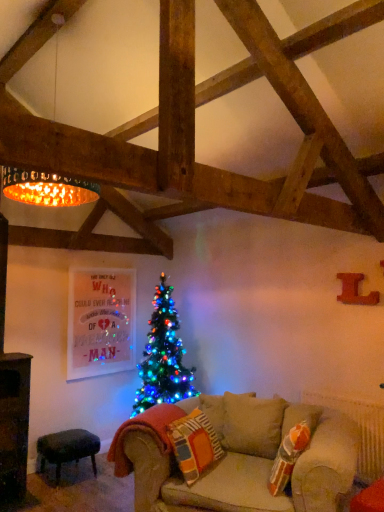
What is the approximate width of velvet dark green stool at lower left?

velvet dark green stool at lower left is 20.85 inches in width.

Describe the element at coordinates (47, 188) in the screenshot. I see `golden metallic lampshade at upper left` at that location.

Find the location of a particular element. Image resolution: width=384 pixels, height=512 pixels. velvet dark green stool at lower left is located at coordinates (67, 449).

Would you say velvet dark green stool at lower left is a long distance from knitted fabric pillow at lower center?

Indeed, velvet dark green stool at lower left is not near knitted fabric pillow at lower center.

The width and height of the screenshot is (384, 512). I want to click on stool that appears below the knitted fabric pillow at lower center (from the image's perspective), so click(x=67, y=449).

Is velvet dark green stool at lower left bigger than knitted fabric pillow at lower center?

Yes, velvet dark green stool at lower left is bigger than knitted fabric pillow at lower center.

Is velvet dark green stool at lower left oriented away from knitted fabric pillow at lower center?

velvet dark green stool at lower left is not turned away from knitted fabric pillow at lower center.

Could you tell me if velvet dark green stool at lower left is turned towards golden metallic lampshade at upper left?

No, velvet dark green stool at lower left is not oriented towards golden metallic lampshade at upper left.

Find the location of `stool that is on the left side of golden metallic lampshade at upper left`. stool that is on the left side of golden metallic lampshade at upper left is located at coordinates (67, 449).

Is velvet dark green stool at lower left directly adjacent to golden metallic lampshade at upper left?

No, velvet dark green stool at lower left is not making contact with golden metallic lampshade at upper left.

Is golden metallic lampshade at upper left closer to the viewer compared to velvet dark green stool at lower left?

Yes, golden metallic lampshade at upper left is in front of velvet dark green stool at lower left.

Considering the relative sizes of golden metallic lampshade at upper left and velvet dark green stool at lower left in the image provided, is golden metallic lampshade at upper left shorter than velvet dark green stool at lower left?

No, golden metallic lampshade at upper left is not shorter than velvet dark green stool at lower left.

Consider the image. From a real-world perspective, between golden metallic lampshade at upper left and velvet dark green stool at lower left, who is vertically lower?

From a 3D spatial view, velvet dark green stool at lower left is below.

From the image's perspective, is golden metallic lampshade at upper left located beneath velvet dark green stool at lower left?

No.

From a real-world perspective, is golden metallic lampshade at upper left physically below knitted fabric pillow at lower center?

No, from a real-world perspective, golden metallic lampshade at upper left is not below knitted fabric pillow at lower center.

From the image's perspective, between golden metallic lampshade at upper left and knitted fabric pillow at lower center, which one is located above?

golden metallic lampshade at upper left appears higher in the image.

Is golden metallic lampshade at upper left facing away from knitted fabric pillow at lower center?

No.

Between golden metallic lampshade at upper left and knitted fabric pillow at lower center, which one has larger size?

golden metallic lampshade at upper left is bigger.

From a real-world perspective, does knitted fabric pillow at lower center sit lower than velvet dark green stool at lower left?

No, from a real-world perspective, knitted fabric pillow at lower center is not under velvet dark green stool at lower left.

Is point (215, 436) more distant than point (56, 467)?

No, (215, 436) is in front of (56, 467).

Which object is closer to the camera, knitted fabric pillow at lower center or velvet dark green stool at lower left?

knitted fabric pillow at lower center is more forward.

Is knitted fabric pillow at lower center inside the boundaries of velvet dark green stool at lower left, or outside?

The correct answer is: outside.

Considering the sizes of objects knitted fabric pillow at lower center and golden metallic lampshade at upper left in the image provided, who is wider, knitted fabric pillow at lower center or golden metallic lampshade at upper left?

golden metallic lampshade at upper left is wider.

This screenshot has height=512, width=384. I want to click on lamp above the knitted fabric pillow at lower center (from the image's perspective), so click(47, 188).

Considering the positions of objects knitted fabric pillow at lower center and golden metallic lampshade at upper left in the image provided, who is behind, knitted fabric pillow at lower center or golden metallic lampshade at upper left?

knitted fabric pillow at lower center is further away from the camera.

The image size is (384, 512). Identify the location of pillow positioned vertically above the velvet dark green stool at lower left (from a real-world perspective). [194, 444].

You are a GUI agent. You are given a task and a screenshot of the screen. Output one action in this format:
    pyautogui.click(x=<x>, y=<y>)
    Task: Click on the lamp lying on the right of velvet dark green stool at lower left
    This screenshot has width=384, height=512.
    Given the screenshot: What is the action you would take?
    pyautogui.click(x=47, y=188)

Estimate the real-world distances between objects in this image. Which object is further from golden metallic lampshade at upper left, knitted fabric pillow at lower center or velvet dark green stool at lower left?

velvet dark green stool at lower left lies further to golden metallic lampshade at upper left than the other object.

Estimate the real-world distances between objects in this image. Which object is further from knitted fabric pillow at lower center, velvet dark green stool at lower left or golden metallic lampshade at upper left?

golden metallic lampshade at upper left is positioned further to the anchor knitted fabric pillow at lower center.

Looking at the image, which one is located further to golden metallic lampshade at upper left, velvet dark green stool at lower left or knitted fabric pillow at lower center?

Based on the image, velvet dark green stool at lower left appears to be further to golden metallic lampshade at upper left.

Which object lies further to the anchor point knitted fabric pillow at lower center, golden metallic lampshade at upper left or velvet dark green stool at lower left?

Based on the image, golden metallic lampshade at upper left appears to be further to knitted fabric pillow at lower center.

Which object lies nearer to the anchor point velvet dark green stool at lower left, golden metallic lampshade at upper left or knitted fabric pillow at lower center?

knitted fabric pillow at lower center is positioned closer to the anchor velvet dark green stool at lower left.

Looking at the image, which one is located further to velvet dark green stool at lower left, knitted fabric pillow at lower center or golden metallic lampshade at upper left?

golden metallic lampshade at upper left lies further to velvet dark green stool at lower left than the other object.

The image size is (384, 512). What are the coordinates of `pillow that lies between golden metallic lampshade at upper left and velvet dark green stool at lower left from top to bottom` in the screenshot? It's located at (194, 444).